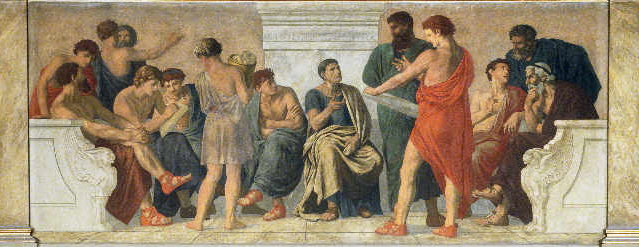
Image resolution: width=639 pixels, height=247 pixels. Identify the location of wall. (491, 24), (199, 20).